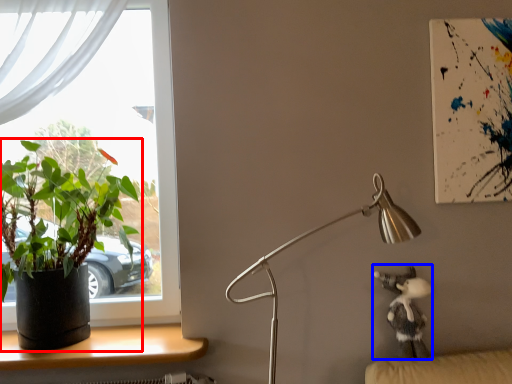
Question: Which object is closer to the camera taking this photo, houseplant (highlighted by a red box) or toy (highlighted by a blue box)?

Choices:
 (A) houseplant
 (B) toy

Answer: (A)